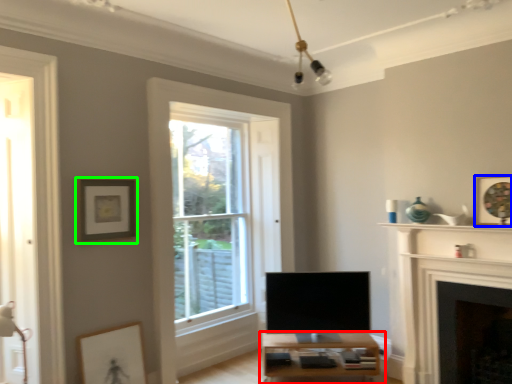
Question: Which object is positioned farthest from table (highlighted by a red box)? Select from picture frame (highlighted by a blue box) and picture frame (highlighted by a green box).

Choices:
 (A) picture frame
 (B) picture frame

Answer: (B)